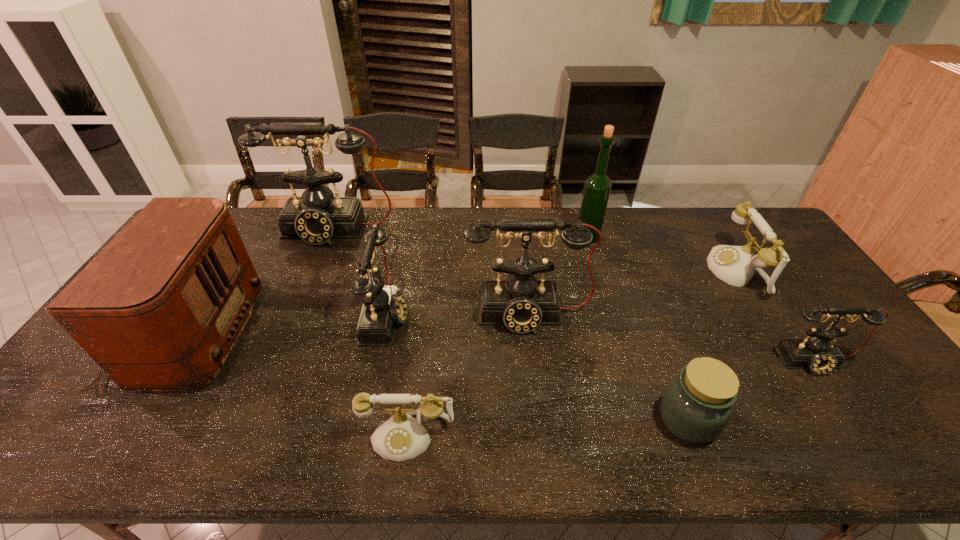
This screenshot has height=540, width=960. Identify the location of vacant space that satisfies the following two spatial constraints: 1. on the dial of the bigger white telephone; 2. on the dial of the third telephone from right to left. (763, 315).